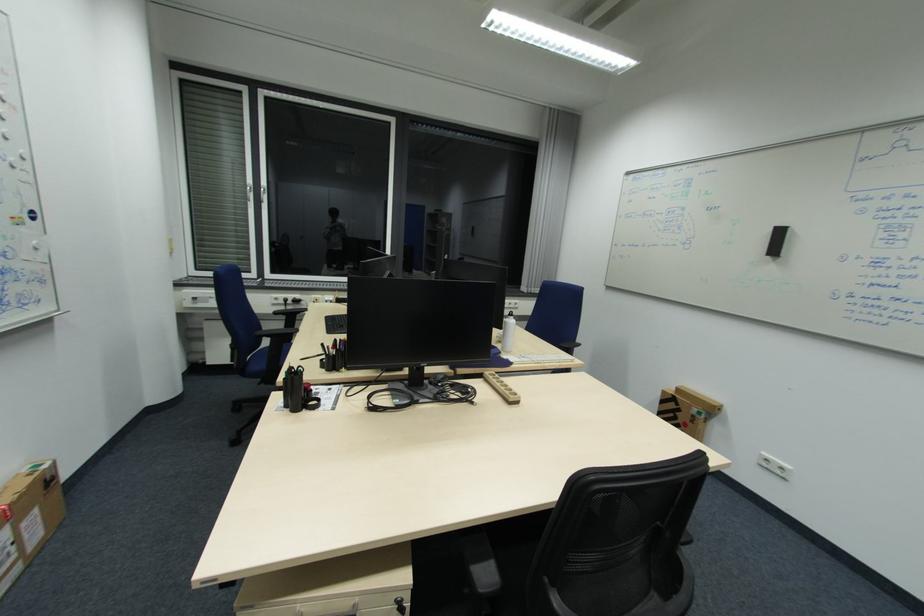
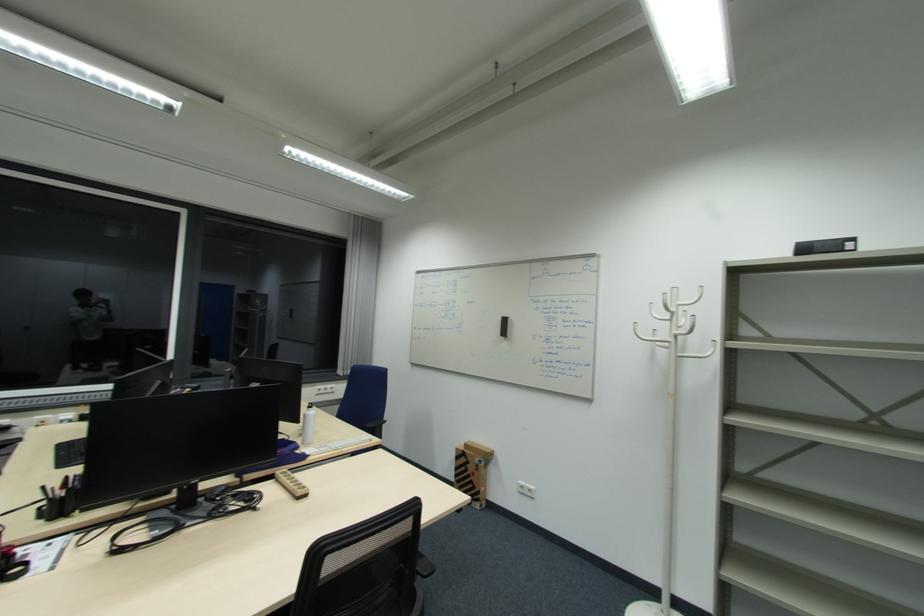
Question: The camera is either moving clockwise (left) or counter-clockwise (right) around the object. The first image is from the beginning of the video and the second image is from the end. Is the camera moving left or right when shooting the video?

Choices:
 (A) Left
 (B) Right

Answer: (A)